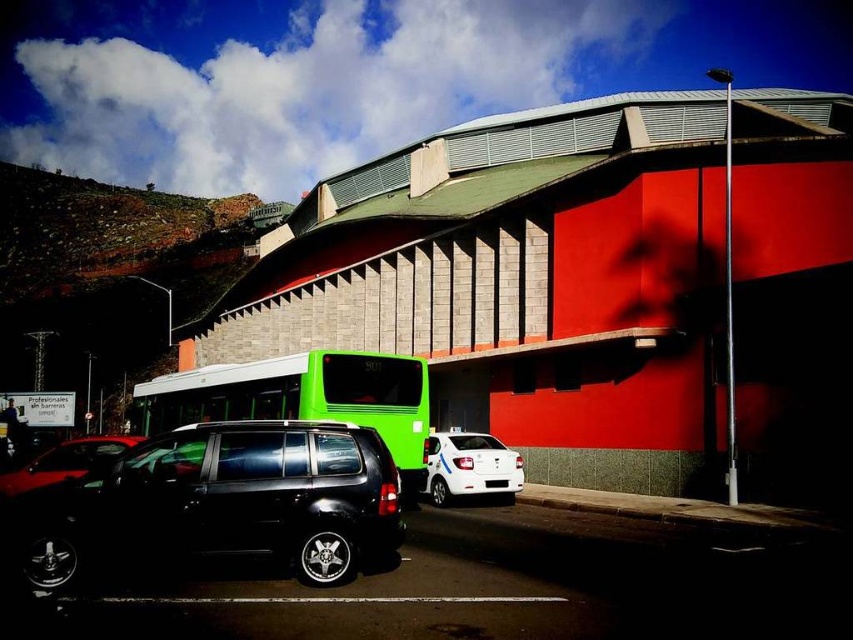
Is shiny black car at lower left thinner than white plastic license plate at center?

In fact, shiny black car at lower left might be wider than white plastic license plate at center.

The image size is (853, 640). Describe the element at coordinates (64, 461) in the screenshot. I see `shiny black car at lower left` at that location.

Locate an element on the screen. The width and height of the screenshot is (853, 640). shiny black car at lower left is located at coordinates (x=64, y=461).

Which is more to the right, green matte bus at center or white glossy car at center?

From the viewer's perspective, white glossy car at center appears more on the right side.

Who is taller, green matte bus at center or white glossy car at center?

green matte bus at center is taller.

Does point (260, 412) lie behind point (489, 456)?

Yes.

Locate an element on the screen. The image size is (853, 640). green matte bus at center is located at coordinates tap(300, 397).

Is glossy black suv at center bigger than shiny black car at lower left?

Incorrect, glossy black suv at center is not larger than shiny black car at lower left.

This screenshot has height=640, width=853. Identify the location of glossy black suv at center. (221, 500).